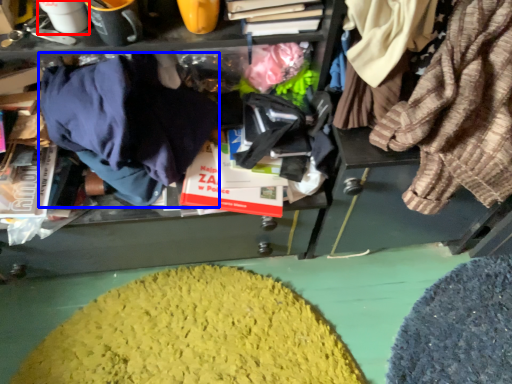
Question: Which point is further to the camera, coffee cup (highlighted by a red box) or clothing (highlighted by a blue box)?

Choices:
 (A) coffee cup
 (B) clothing

Answer: (A)